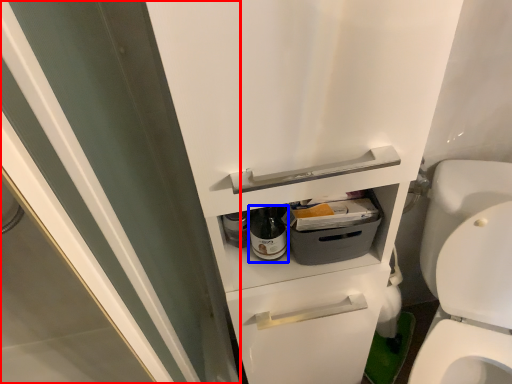
Question: Among these objects, which one is farthest to the camera, screen door (highlighted by a red box) or bottle (highlighted by a blue box)?

Choices:
 (A) screen door
 (B) bottle

Answer: (B)